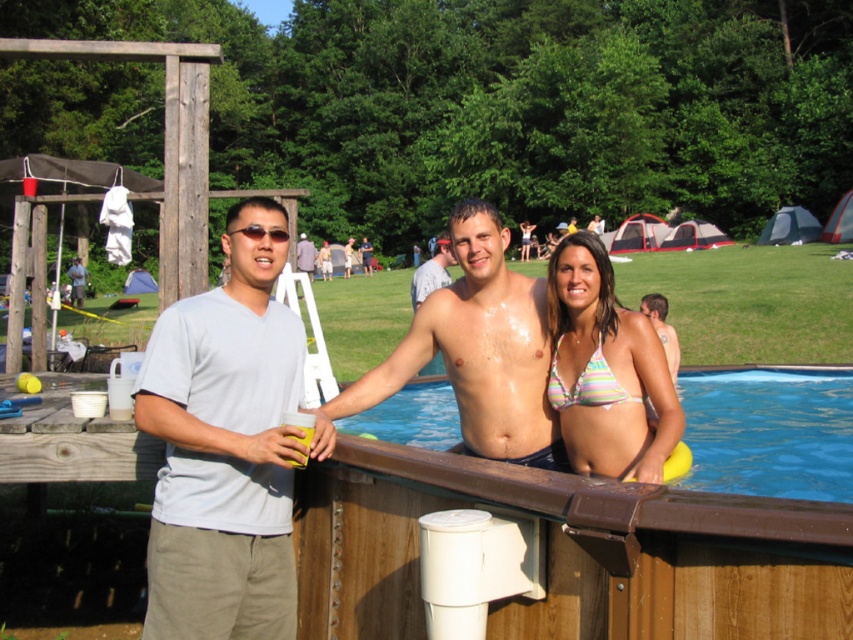
Question: Observing the image, what is the correct spatial positioning of striped fabric bikini at upper center in reference to shiny skin torso at center?

Choices:
 (A) above
 (B) below

Answer: (B)

Question: Which object is closer to the camera taking this photo?

Choices:
 (A) shiny skin torso at center
 (B) gray cotton t-shirt at upper center

Answer: (A)

Question: Which of the following is the farthest from the observer?

Choices:
 (A) (811, 442)
 (B) (476, 216)
 (C) (663, 305)
 (D) (305, 269)

Answer: (D)

Question: Which object appears closest to the camera in this image?

Choices:
 (A) gray cotton t-shirt at left
 (B) shiny skin torso at center
 (C) striped fabric bikini at upper center
 (D) blue wooden swimming pool at center

Answer: (A)

Question: Is striped fabric bikini at upper center smaller than gray cotton t-shirt at upper center?

Choices:
 (A) yes
 (B) no

Answer: (A)

Question: From the image, what is the correct spatial relationship of striped fabric bikini at upper center in relation to gray cotton t-shirt at upper center?

Choices:
 (A) right
 (B) left

Answer: (A)